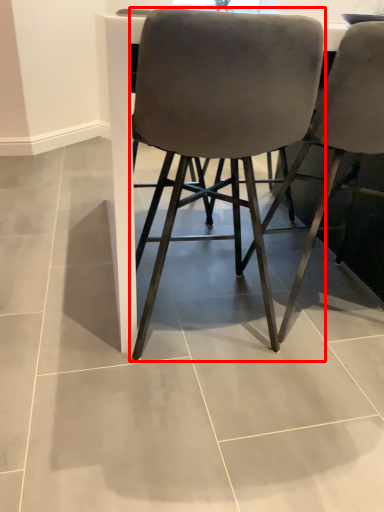
Question: From the image's perspective, what is the correct spatial relationship of chair (annotated by the red box) in relation to chair?

Choices:
 (A) below
 (B) above

Answer: (A)